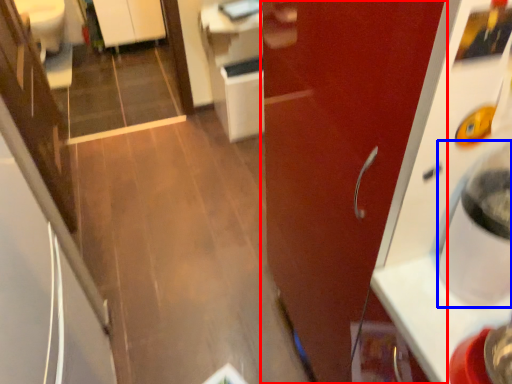
Question: Which object is closer to the camera taking this photo, door (highlighted by a red box) or water cooler (highlighted by a blue box)?

Choices:
 (A) door
 (B) water cooler

Answer: (B)